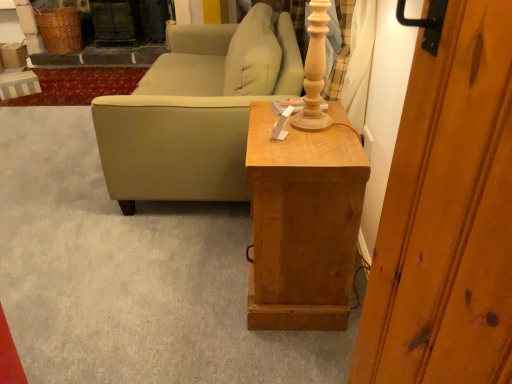
Question: Visually, is beige fabric couch at center positioned to the left or to the right of wooden side table at center?

Choices:
 (A) right
 (B) left

Answer: (B)

Question: Is beige fabric couch at center taller or shorter than wooden side table at center?

Choices:
 (A) tall
 (B) short

Answer: (A)

Question: Considering their positions, is beige fabric couch at center located in front of or behind wooden side table at center?

Choices:
 (A) behind
 (B) front

Answer: (A)

Question: Which is correct: wooden side table at center is inside beige fabric couch at center, or outside of it?

Choices:
 (A) outside
 (B) inside

Answer: (A)

Question: In terms of height, does wooden side table at center look taller or shorter compared to beige fabric couch at center?

Choices:
 (A) tall
 (B) short

Answer: (B)

Question: From a real-world perspective, is wooden side table at center positioned above or below beige fabric couch at center?

Choices:
 (A) above
 (B) below

Answer: (B)

Question: Is wooden side table at center bigger or smaller than beige fabric couch at center?

Choices:
 (A) big
 (B) small

Answer: (B)